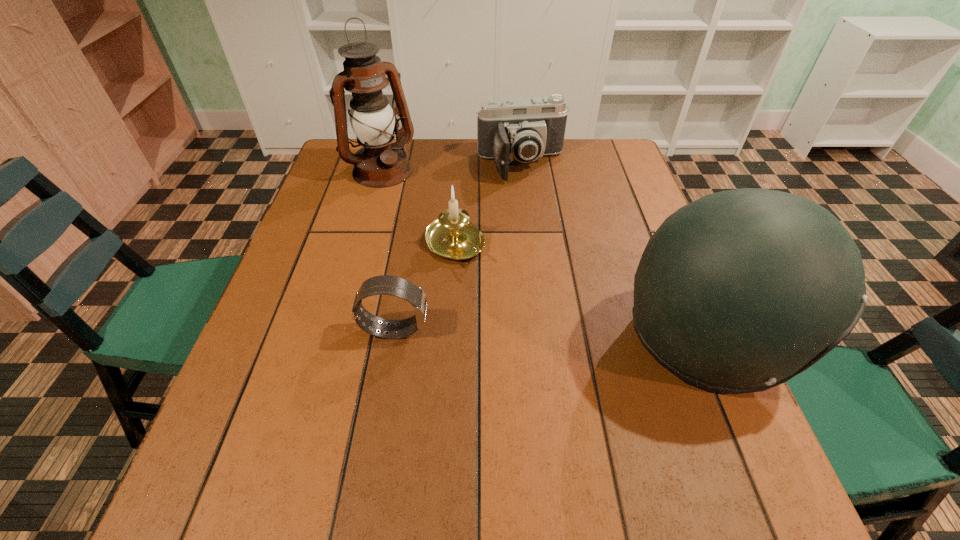
Image resolution: width=960 pixels, height=540 pixels. I want to click on object at the right edge, so click(739, 291).

Find the location of a particular element. object at the far left corner is located at coordinates (380, 163).

Image resolution: width=960 pixels, height=540 pixels. I want to click on object at the near right corner, so click(x=739, y=291).

Find the location of `free point at the far edge`. free point at the far edge is located at coordinates click(561, 166).

Locate an element on the screen. free space at the near edge of the desktop is located at coordinates click(380, 447).

This screenshot has height=540, width=960. I want to click on free spot at the left edge of the desktop, so click(x=370, y=213).

Image resolution: width=960 pixels, height=540 pixels. In the image, there is a desktop. In order to click on vacant space at the right edge in this screenshot , I will do (636, 214).

This screenshot has width=960, height=540. Identify the location of free spot between the rightmost object and the camera. (613, 252).

The width and height of the screenshot is (960, 540). I want to click on free area in between the rightmost object and the camera, so click(x=613, y=252).

The image size is (960, 540). In order to click on blank region between the second tallest object and the lantern in this screenshot , I will do `click(543, 255)`.